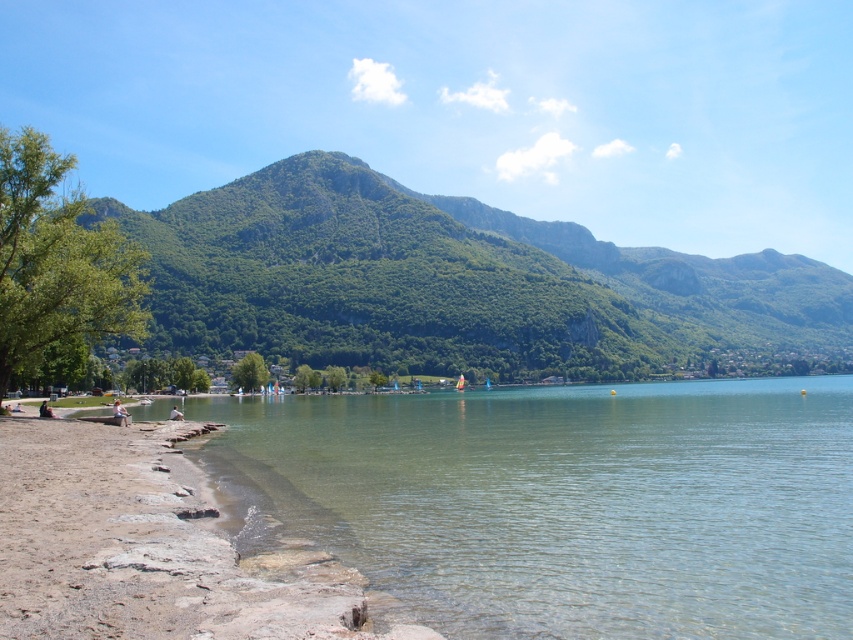
You are planning to take a photo of the clear water at shore left and the green leafy mountain at center. Which object will appear wider in the photo?

The green leafy mountain at center will appear wider in the photo because its width is greater than the clear water at shore left according to the description.

You are standing on the sandy beach and want to take a photo of both the clear water at shore left and the green leafy mountain at center. Which object should you position closer to the left side of your camera frame?

You should position the clear water at shore left closer to the left side of your camera frame since it is located to the left of the green leafy mountain at center.

You are a photographer planning to capture the clear water at shore left and the green leafy mountain at center in a single shot. Considering their sizes in the image, which object would appear smaller in your photograph?

The clear water at shore left would appear smaller in the photograph compared to the green leafy mountain at center because the clear water at shore left has a smaller size compared to green leafy mountain at center.